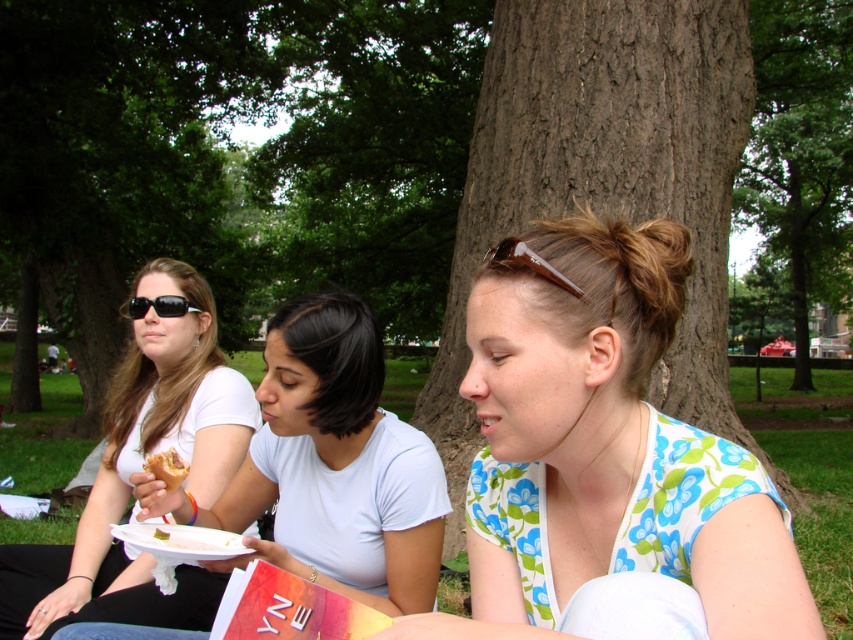
Is white matte shirt at center taller than golden bread at center?

Yes.

Does point (172, 369) come farther from viewer compared to point (149, 460)?

Yes, it is.

Is point (178, 396) positioned in front of point (170, 456)?

No, it is not.

This screenshot has height=640, width=853. I want to click on white matte shirt at center, so click(138, 470).

Does floral print blouse at center appear over white matte shirt at left?

Indeed, floral print blouse at center is positioned over white matte shirt at left.

Is point (471, 339) positioned behind point (363, 426)?

No, it is in front of (363, 426).

What do you see at coordinates (606, 461) in the screenshot?
I see `floral print blouse at center` at bounding box center [606, 461].

The image size is (853, 640). In order to click on floral print blouse at center in this screenshot , I will do `click(606, 461)`.

Is white matte shirt at left thinner than matte black sunglasses at upper left?

Yes, white matte shirt at left is thinner than matte black sunglasses at upper left.

This screenshot has height=640, width=853. Describe the element at coordinates (334, 465) in the screenshot. I see `white matte shirt at left` at that location.

You are a GUI agent. You are given a task and a screenshot of the screen. Output one action in this format:
    pyautogui.click(x=<x>, y=<y>)
    Task: Click on the white matte shirt at left
    The height and width of the screenshot is (640, 853).
    Given the screenshot: What is the action you would take?
    pyautogui.click(x=334, y=465)